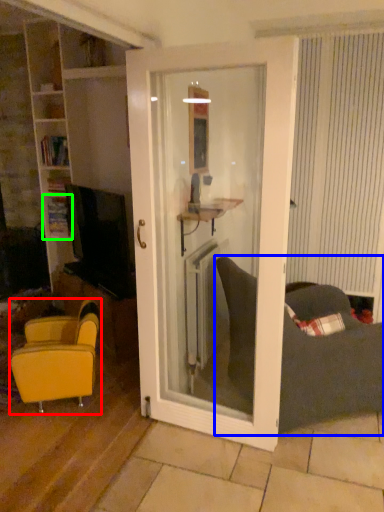
Question: Which object is positioned farthest from chair (highlighted by a red box)? Select from studio couch (highlighted by a blue box) and shelf (highlighted by a green box).

Choices:
 (A) studio couch
 (B) shelf

Answer: (B)